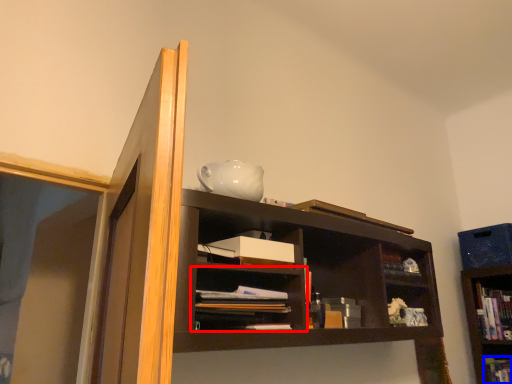
Question: Which object is closer to the camera taking this photo, shelf (highlighted by a red box) or book (highlighted by a blue box)?

Choices:
 (A) shelf
 (B) book

Answer: (A)